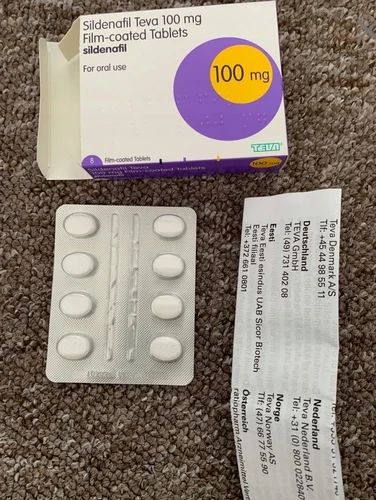
The height and width of the screenshot is (500, 376). Find the location of `box`. box is located at coordinates (112, 112).